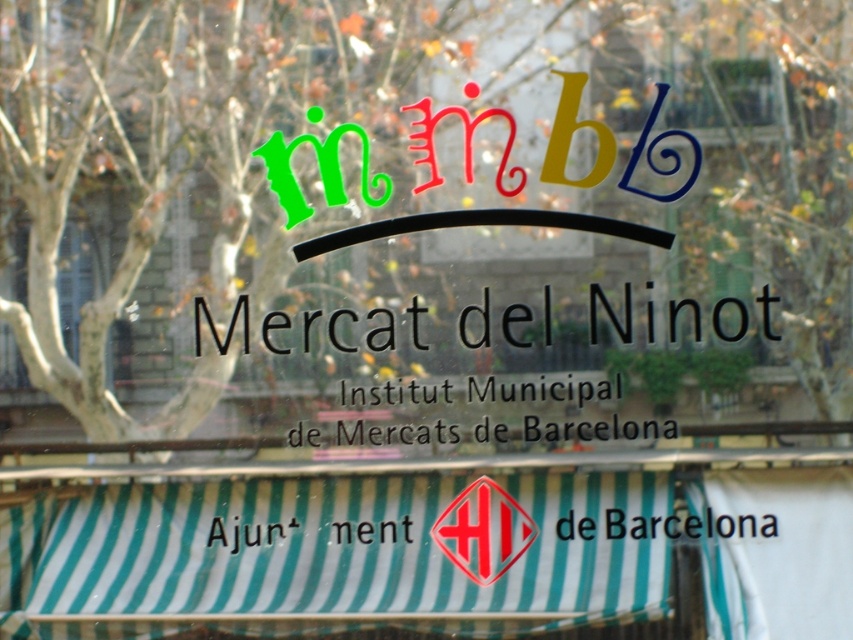
Image resolution: width=853 pixels, height=640 pixels. What do you see at coordinates (227, 326) in the screenshot?
I see `black matte mercat del ninot at center` at bounding box center [227, 326].

Is black matte mercat del ninot at center to the right of red glossy diamond at center from the viewer's perspective?

Correct, you'll find black matte mercat del ninot at center to the right of red glossy diamond at center.

Is point (766, 300) closer to camera compared to point (462, 561)?

That is True.

The height and width of the screenshot is (640, 853). Find the location of `black matte mercat del ninot at center`. black matte mercat del ninot at center is located at coordinates (227, 326).

Can you confirm if black matte mercat del ninot at center is positioned to the right of black paper at lower center?

In fact, black matte mercat del ninot at center is to the left of black paper at lower center.

Does point (698, 339) lie behind point (561, 534)?

No, (698, 339) is closer to viewer.

In order to click on black matte mercat del ninot at center in this screenshot , I will do `click(227, 326)`.

Identify the location of black matte mercat del ninot at center. The image size is (853, 640). (227, 326).

Between green striped awning at lower center and red glossy diamond at center, which one appears on the right side from the viewer's perspective?

red glossy diamond at center

Is green striped awning at lower center smaller than red glossy diamond at center?

No.

Who is more distant from viewer, (566, 604) or (480, 582)?

Positioned behind is point (480, 582).

The height and width of the screenshot is (640, 853). In order to click on green striped awning at lower center in this screenshot , I will do `click(422, 545)`.